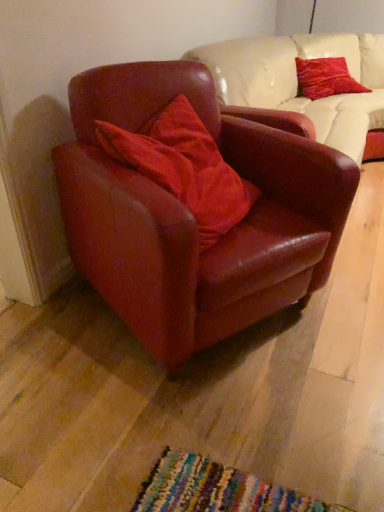
Question: Can we say velvet red pillow at upper right, placed as the second pillow when sorted from bottom to top, lies outside satin burgundy armchair at center?

Choices:
 (A) no
 (B) yes

Answer: (B)

Question: Is velvet red pillow at upper right, placed as the second pillow when sorted from bottom to top, to the left of satin burgundy armchair at center from the viewer's perspective?

Choices:
 (A) yes
 (B) no

Answer: (B)

Question: Can you confirm if velvet red pillow at upper right, the 1th pillow viewed from the back, is taller than satin burgundy armchair at center?

Choices:
 (A) no
 (B) yes

Answer: (A)

Question: Is velvet red pillow at upper right, arranged as the 1th pillow when viewed from the right, aimed at satin burgundy armchair at center?

Choices:
 (A) no
 (B) yes

Answer: (A)

Question: From the image's perspective, would you say velvet red pillow at upper right, the 2th pillow in the left-to-right sequence, is positioned over satin burgundy armchair at center?

Choices:
 (A) yes
 (B) no

Answer: (A)

Question: Relative to satin burgundy armchair at center, is satin red pillow at center, the second pillow viewed from the top, in front or behind?

Choices:
 (A) front
 (B) behind

Answer: (B)

Question: From a real-world perspective, relative to satin burgundy armchair at center, is satin red pillow at center, placed as the first pillow when sorted from left to right, vertically above or below?

Choices:
 (A) below
 (B) above

Answer: (B)

Question: Considering the positions of point (160, 160) and point (304, 278), is point (160, 160) closer or farther from the camera than point (304, 278)?

Choices:
 (A) closer
 (B) farther

Answer: (A)

Question: From the image's perspective, is satin red pillow at center, the second pillow viewed from the top, above or below satin burgundy armchair at center?

Choices:
 (A) above
 (B) below

Answer: (A)

Question: Relative to velvet red pillow at upper right, the second pillow in the front-to-back sequence, is satin burgundy armchair at center in front or behind?

Choices:
 (A) behind
 (B) front

Answer: (B)

Question: In terms of width, does satin burgundy armchair at center look wider or thinner when compared to velvet red pillow at upper right, the second pillow in the front-to-back sequence?

Choices:
 (A) thin
 (B) wide

Answer: (B)

Question: Looking at the image, does satin burgundy armchair at center seem bigger or smaller compared to velvet red pillow at upper right, the 2th pillow in the left-to-right sequence?

Choices:
 (A) big
 (B) small

Answer: (A)

Question: From their relative heights in the image, would you say satin burgundy armchair at center is taller or shorter than velvet red pillow at upper right, arranged as the first pillow when viewed from the top?

Choices:
 (A) tall
 (B) short

Answer: (A)

Question: Do you think velvet red pillow at upper right, the second pillow in the front-to-back sequence, is within satin red pillow at center, which is the 1th pillow in front-to-back order, or outside of it?

Choices:
 (A) inside
 (B) outside

Answer: (B)

Question: Is velvet red pillow at upper right, arranged as the first pillow when viewed from the top, wider or thinner than satin red pillow at center, the second pillow viewed from the top?

Choices:
 (A) thin
 (B) wide

Answer: (A)